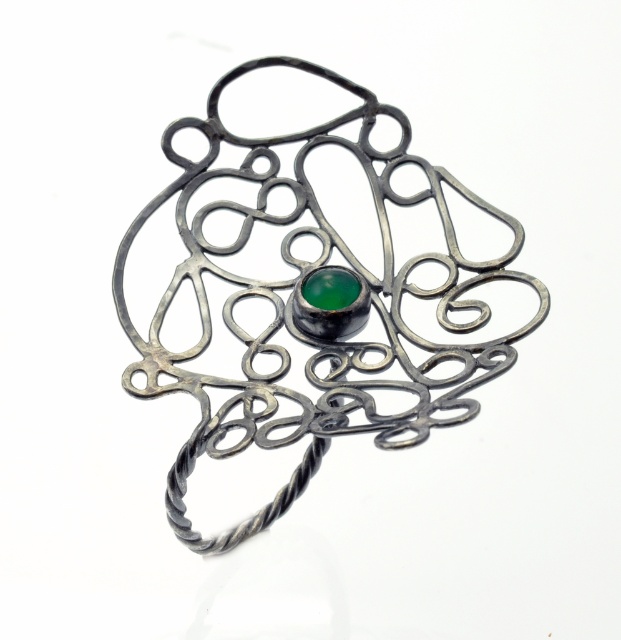
Question: Can you confirm if polished silver ring at center is positioned to the left of green glass at center?

Choices:
 (A) yes
 (B) no

Answer: (B)

Question: Observing the image, what is the correct spatial positioning of polished silver ring at center in reference to green glass at center?

Choices:
 (A) above
 (B) below

Answer: (B)

Question: Which object appears farthest from the camera in this image?

Choices:
 (A) green glass at center
 (B) polished silver ring at center

Answer: (A)

Question: Does polished silver ring at center have a larger size compared to green glass at center?

Choices:
 (A) yes
 (B) no

Answer: (A)

Question: Which object is farther from the camera taking this photo?

Choices:
 (A) green glass at center
 (B) polished silver ring at center

Answer: (A)

Question: Among these points, which one is farthest from the camera?

Choices:
 (A) (401, 388)
 (B) (325, 275)

Answer: (B)